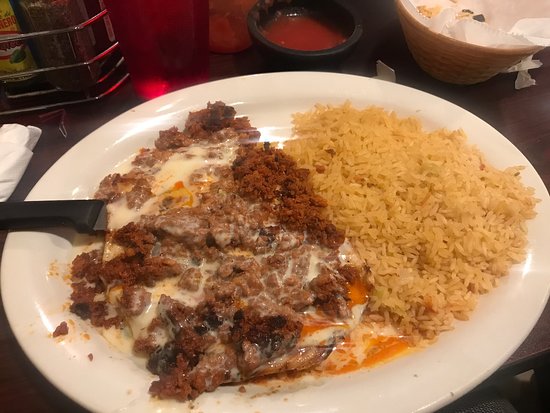
Find the location of a particular element. The width and height of the screenshot is (550, 413). 1 beige basket is located at coordinates (441, 53).